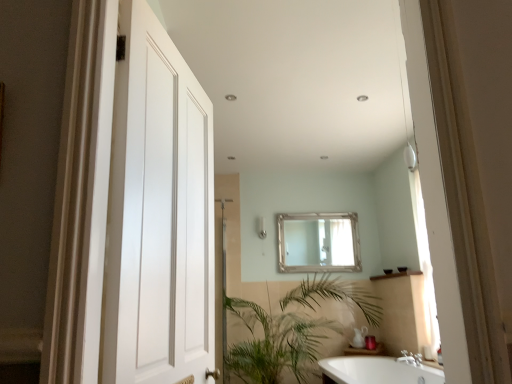
Question: Do you think satin nickel shower at center is within silver metallic mirror at center, or outside of it?

Choices:
 (A) inside
 (B) outside

Answer: (B)

Question: Based on their sizes in the image, would you say satin nickel shower at center is bigger or smaller than silver metallic mirror at center?

Choices:
 (A) big
 (B) small

Answer: (B)

Question: Considering the real-world distances, which object is closest to the silver metallic mirror at center?

Choices:
 (A) green leafy plant at lower center
 (B) white glossy bathtub at lower right
 (C) white matte door at left
 (D) satin nickel shower at center

Answer: (D)

Question: Based on their relative distances, which object is nearer to the white matte door at left?

Choices:
 (A) satin nickel shower at center
 (B) silver metallic mirror at center
 (C) white glossy bathtub at lower right
 (D) green leafy plant at lower center

Answer: (C)